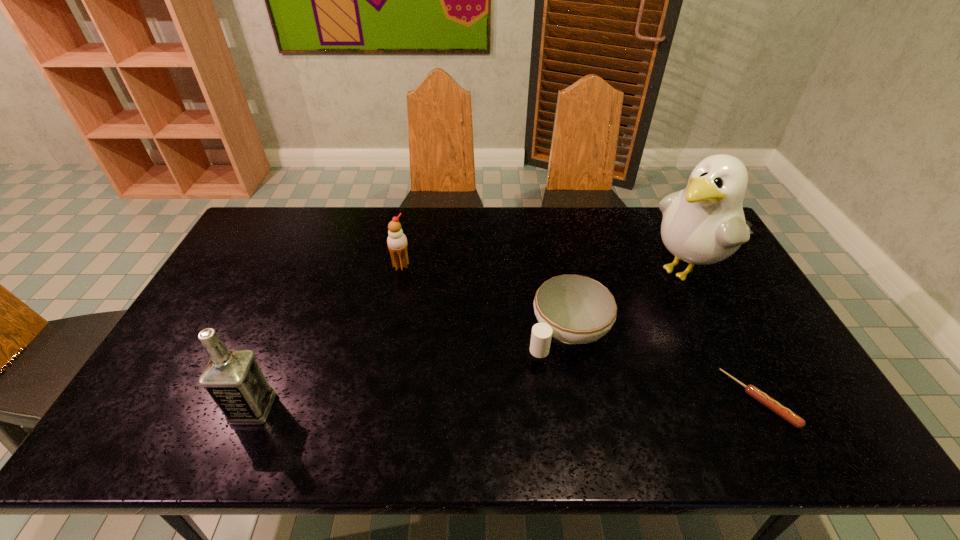
You are a GUI agent. You are given a task and a screenshot of the screen. Output one action in this format:
    pyautogui.click(x=<x>, y=<y>)
    Task: Click on the vodka
    This screenshot has width=960, height=540.
    Given the screenshot: What is the action you would take?
    pyautogui.click(x=233, y=378)

Find the location of `the fourth shortest object`. the fourth shortest object is located at coordinates (233, 378).

Image resolution: width=960 pixels, height=540 pixels. What are the coordinates of `sausage` in the screenshot? It's located at (760, 396).

Image resolution: width=960 pixels, height=540 pixels. Find the location of `the second shortest object`. the second shortest object is located at coordinates (574, 309).

This screenshot has height=540, width=960. In order to click on chinaware in this screenshot , I will do (x=574, y=309).

Find the location of a particular element. icecream is located at coordinates (397, 242).

This screenshot has width=960, height=540. Find the location of `the third tallest object`. the third tallest object is located at coordinates (397, 242).

At what (x,y) coordinates should I click in order to perform the action: click on gull. Please return your answer as a coordinate pair (x, y). The width and height of the screenshot is (960, 540). Looking at the image, I should click on (704, 223).

This screenshot has width=960, height=540. Find the location of `vacant space located on the front label of the leftmost object`. vacant space located on the front label of the leftmost object is located at coordinates (168, 408).

Find the location of a particular element. Image resolution: width=960 pixels, height=540 pixels. free point located on the front label of the leftmost object is located at coordinates (152, 408).